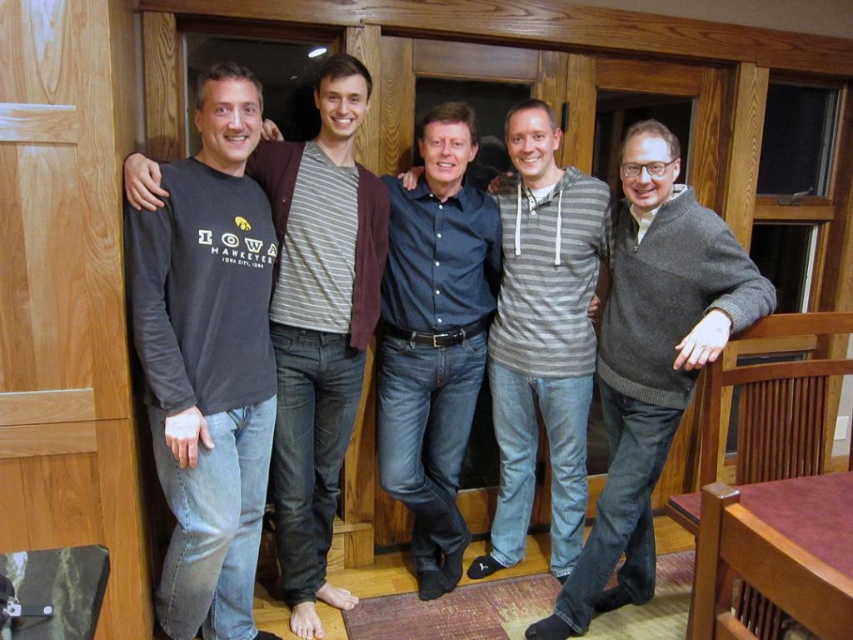
The image size is (853, 640). I want to click on dark gray sweater at right, so click(x=651, y=360).

Which of these two, dark gray sweater at right or dark blue shirt at center, stands shorter?

dark gray sweater at right

Find the location of a particular element. The height and width of the screenshot is (640, 853). dark gray sweater at right is located at coordinates (651, 360).

Does dark gray sweater at right appear on the left side of gray striped hoodie at center?

No, dark gray sweater at right is not to the left of gray striped hoodie at center.

The height and width of the screenshot is (640, 853). Describe the element at coordinates (651, 360) in the screenshot. I see `dark gray sweater at right` at that location.

Between point (722, 234) and point (523, 429), which one is positioned in front?

Point (722, 234) is more forward.

At what (x,y) coordinates should I click in order to perform the action: click on dark gray sweater at right. Please return your answer as a coordinate pair (x, y). The image size is (853, 640). Looking at the image, I should click on (651, 360).

Does dark gray long-sleeve shirt at left appear on the right side of gray striped hoodie at center?

No, dark gray long-sleeve shirt at left is not to the right of gray striped hoodie at center.

Consider the image. Is dark gray long-sleeve shirt at left positioned before gray striped hoodie at center?

Yes, dark gray long-sleeve shirt at left is closer to the viewer.

The width and height of the screenshot is (853, 640). In order to click on dark gray long-sleeve shirt at left in this screenshot , I will do `click(318, 321)`.